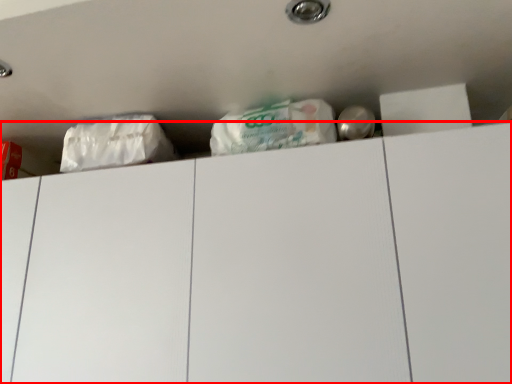
Question: From the image, what is the correct spatial relationship of drawer (annotated by the red box) in relation to plastic bag?

Choices:
 (A) left
 (B) right

Answer: (B)